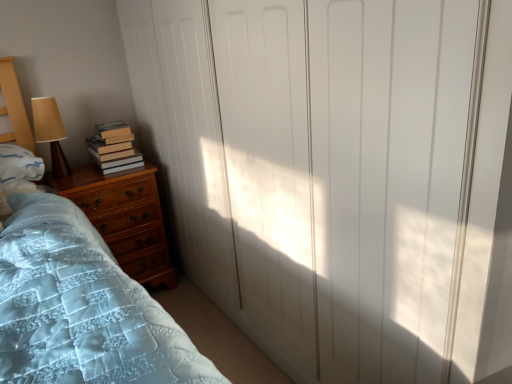
Question: Does white matte closet doors at center lie in front of brown fabric lampshade at left?

Choices:
 (A) no
 (B) yes

Answer: (B)

Question: Does white matte closet doors at center have a greater width compared to brown fabric lampshade at left?

Choices:
 (A) no
 (B) yes

Answer: (B)

Question: Does white matte closet doors at center turn towards brown fabric lampshade at left?

Choices:
 (A) yes
 (B) no

Answer: (A)

Question: From the image's perspective, is white matte closet doors at center beneath brown fabric lampshade at left?

Choices:
 (A) yes
 (B) no

Answer: (A)

Question: Is brown fabric lampshade at left inside white matte closet doors at center?

Choices:
 (A) yes
 (B) no

Answer: (B)

Question: Is wooden chest of drawers at lower left inside or outside of brown fabric lampshade at left?

Choices:
 (A) inside
 (B) outside

Answer: (B)

Question: Looking at their shapes, would you say wooden chest of drawers at lower left is wider or thinner than brown fabric lampshade at left?

Choices:
 (A) thin
 (B) wide

Answer: (B)

Question: Does point (105, 228) appear closer or farther from the camera than point (31, 102)?

Choices:
 (A) closer
 (B) farther

Answer: (B)

Question: In terms of size, does wooden chest of drawers at lower left appear bigger or smaller than brown fabric lampshade at left?

Choices:
 (A) big
 (B) small

Answer: (A)

Question: Considering the positions of hardcover books at left and wooden chest of drawers at lower left in the image, is hardcover books at left wider or thinner than wooden chest of drawers at lower left?

Choices:
 (A) thin
 (B) wide

Answer: (A)

Question: In the image, is hardcover books at left positioned in front of or behind wooden chest of drawers at lower left?

Choices:
 (A) behind
 (B) front

Answer: (A)

Question: Based on their sizes in the image, would you say hardcover books at left is bigger or smaller than wooden chest of drawers at lower left?

Choices:
 (A) small
 (B) big

Answer: (A)

Question: From a real-world perspective, relative to wooden chest of drawers at lower left, is hardcover books at left vertically above or below?

Choices:
 (A) above
 (B) below

Answer: (A)

Question: In terms of width, does brown fabric lampshade at left look wider or thinner when compared to white matte closet doors at center?

Choices:
 (A) wide
 (B) thin

Answer: (B)

Question: In terms of height, does brown fabric lampshade at left look taller or shorter compared to white matte closet doors at center?

Choices:
 (A) short
 (B) tall

Answer: (A)